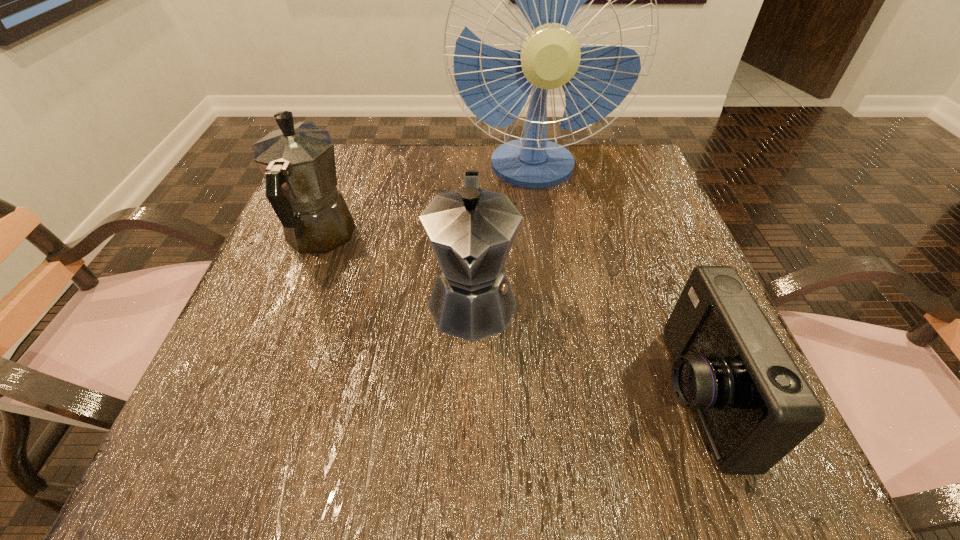
Locate an element on the screen. The image size is (960, 540). free space located on the front-facing side of the shortest object is located at coordinates (567, 395).

Identify the location of free space located 0.240m on the front-facing side of the shortest object. The height and width of the screenshot is (540, 960). (492, 395).

The width and height of the screenshot is (960, 540). Find the location of `vacant space located on the front-facing side of the shortest object`. vacant space located on the front-facing side of the shortest object is located at coordinates (540, 395).

Locate an element on the screen. The height and width of the screenshot is (540, 960). object situated at the far edge is located at coordinates (495, 84).

Locate an element on the screen. object that is positioned at the near edge is located at coordinates (754, 405).

At what (x,y) coordinates should I click in order to perform the action: click on object at the left edge. Please return your answer as a coordinate pair (x, y). The image size is (960, 540). Looking at the image, I should click on (298, 163).

Locate an element on the screen. fan present at the right edge is located at coordinates (495, 84).

The height and width of the screenshot is (540, 960). I want to click on camera present at the right edge, so click(x=754, y=405).

At what (x,y) coordinates should I click in order to perform the action: click on object positioned at the far right corner. Please return your answer as a coordinate pair (x, y). The image size is (960, 540). Looking at the image, I should click on (495, 84).

You are a GUI agent. You are given a task and a screenshot of the screen. Output one action in this format:
    pyautogui.click(x=<x>, y=<y>)
    Task: Click on the object at the near right corner
    This screenshot has width=960, height=540.
    Given the screenshot: What is the action you would take?
    pyautogui.click(x=754, y=405)